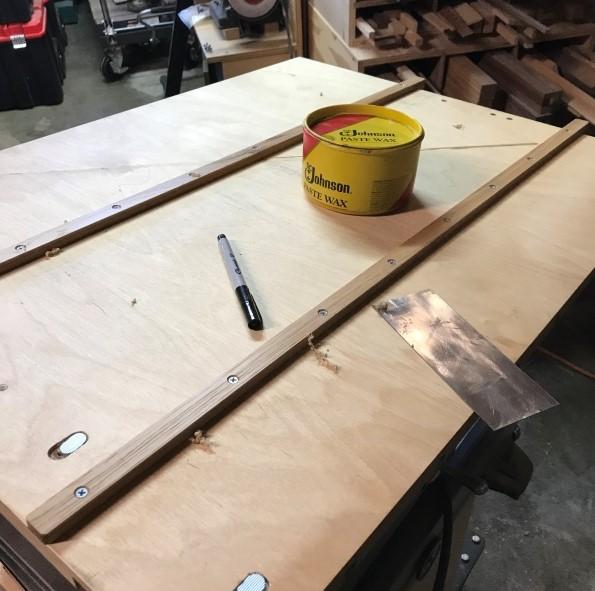
Where is `marker cap`? Image resolution: width=595 pixels, height=591 pixels. marker cap is located at coordinates (250, 305).